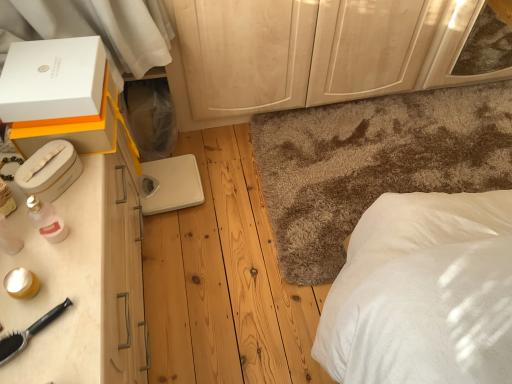
Where is `vacant area that is situated to the right of light wood dresser at center`? vacant area that is situated to the right of light wood dresser at center is located at coordinates (412, 132).